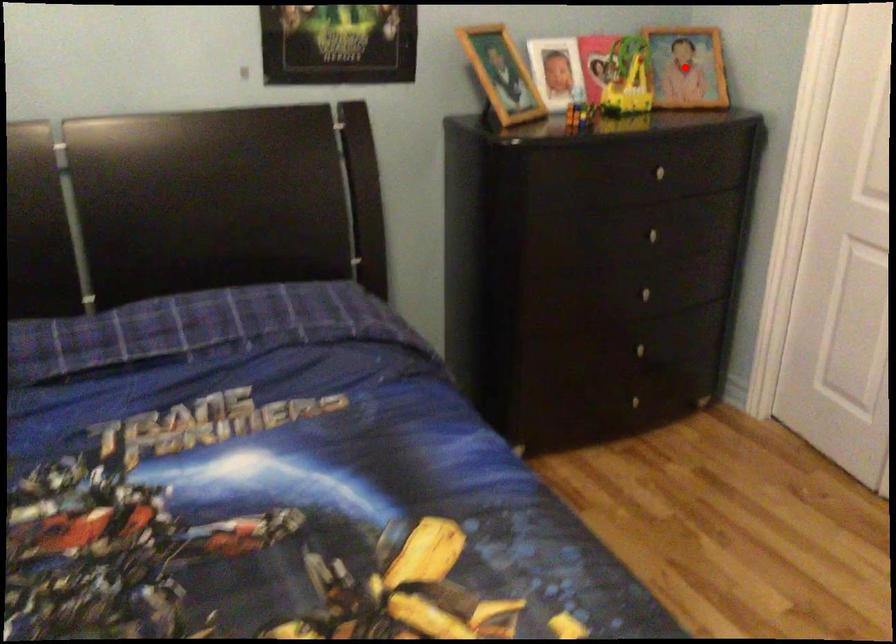
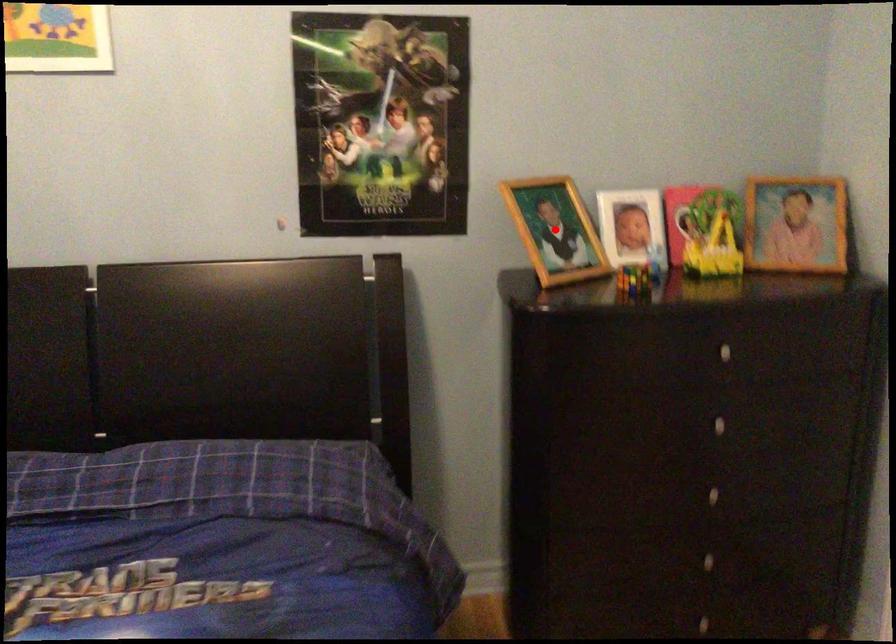
I am providing you with two images of the same scene from different viewpoints. A red point is marked on the first image and another point is marked on the second image. Is the red point in image1 aligned with the point shown in image2?

No